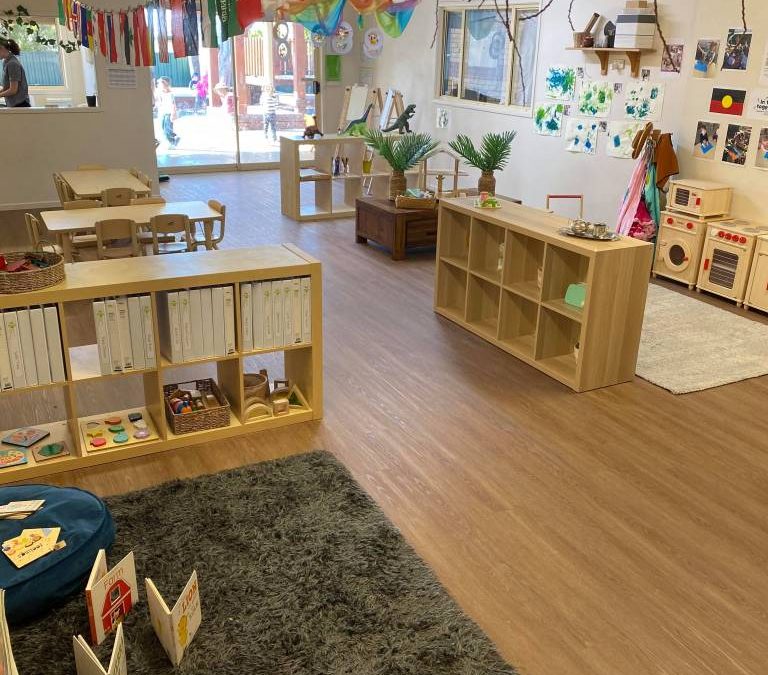
The height and width of the screenshot is (675, 768). What are the coordinates of `small brown chairs` in the screenshot? It's located at (111, 225).